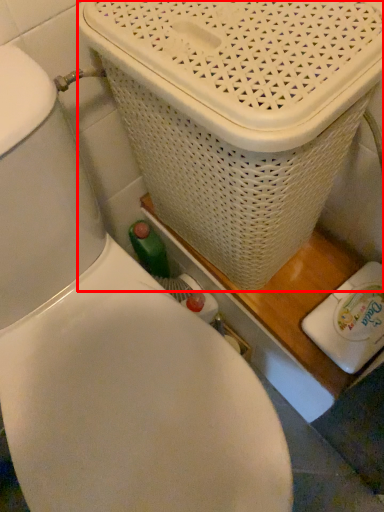
Question: From the image, what is the correct spatial relationship of basket container (annotated by the red box) in relation to appliance?

Choices:
 (A) left
 (B) right

Answer: (A)